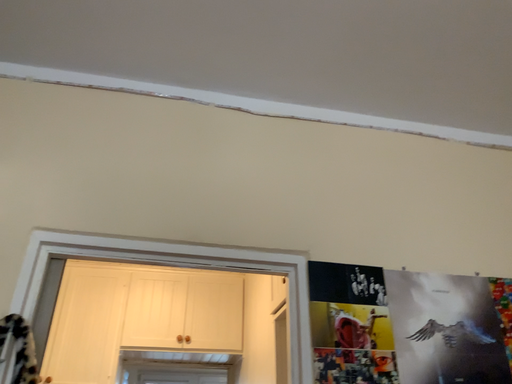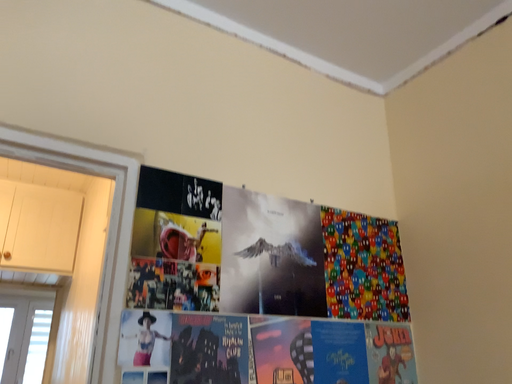
Question: Which way did the camera rotate in the video?

Choices:
 (A) rotated left
 (B) rotated right

Answer: (B)